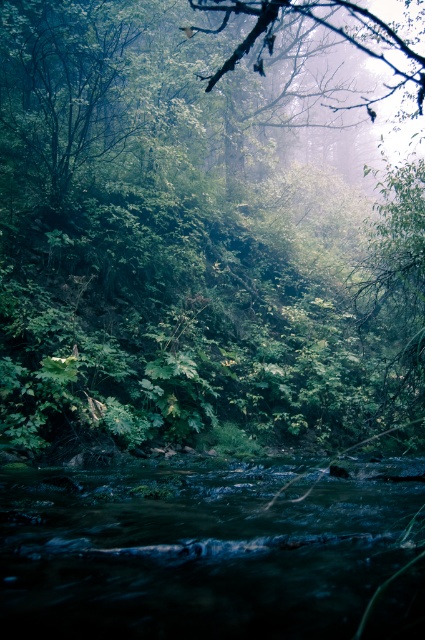
Question: Which point appears closest to the camera in this image?

Choices:
 (A) (176, 600)
 (B) (153, 420)

Answer: (A)

Question: Is green leafy tree at center smaller than dark green water at center?

Choices:
 (A) no
 (B) yes

Answer: (A)

Question: Where is green leafy tree at center located in relation to dark green water at center in the image?

Choices:
 (A) below
 (B) above

Answer: (B)

Question: From the image, what is the correct spatial relationship of green leafy tree at center in relation to dark green water at center?

Choices:
 (A) left
 (B) right

Answer: (B)

Question: Among these points, which one is farthest from the camera?

Choices:
 (A) (407, 483)
 (B) (13, 288)

Answer: (B)